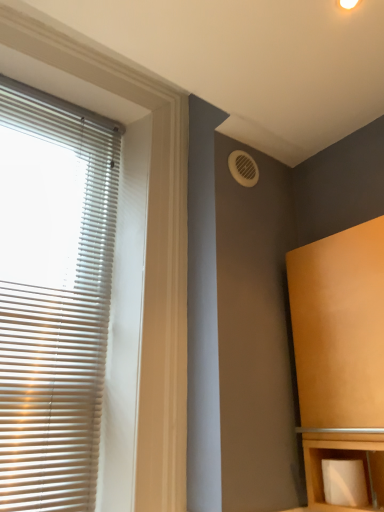
Question: Based on their sizes in the image, would you say matte wood cabinet at right is bigger or smaller than white matte blinds at left?

Choices:
 (A) small
 (B) big

Answer: (B)

Question: From a real-world perspective, relative to white matte blinds at left, is matte wood cabinet at right vertically above or below?

Choices:
 (A) above
 (B) below

Answer: (B)

Question: Which object is the farthest from the white plastic vent at upper right?

Choices:
 (A) matte wood cabinet at right
 (B) white matte toilet paper at lower right
 (C) white matte blinds at left

Answer: (B)

Question: Which object is positioned farthest from the white matte blinds at left?

Choices:
 (A) white plastic vent at upper right
 (B) white matte toilet paper at lower right
 (C) matte wood cabinet at right

Answer: (B)